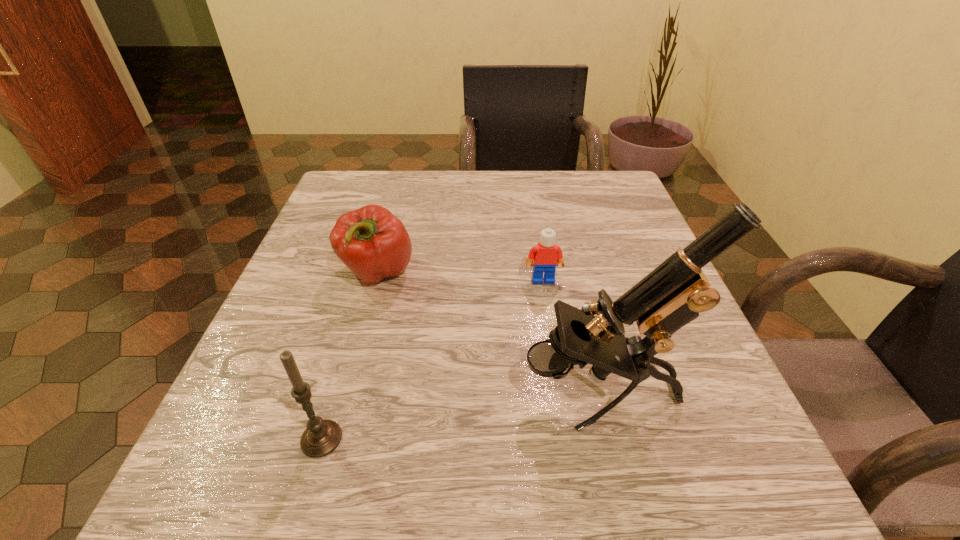
Where is `the closest object relative to the second shortest object`? the closest object relative to the second shortest object is located at coordinates (546, 255).

Identify the location of free space that satisfies the following two spatial constraints: 1. on the back side of the second shortest object; 2. on the left side of the second tallest object. The height and width of the screenshot is (540, 960). (370, 273).